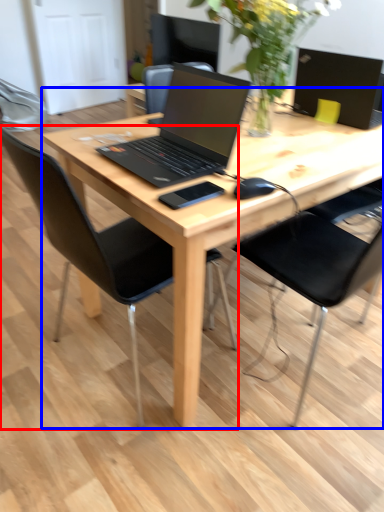
Question: Which object appears closest to the camera in this image, chair (highlighted by a red box) or desk (highlighted by a blue box)?

Choices:
 (A) chair
 (B) desk

Answer: (A)